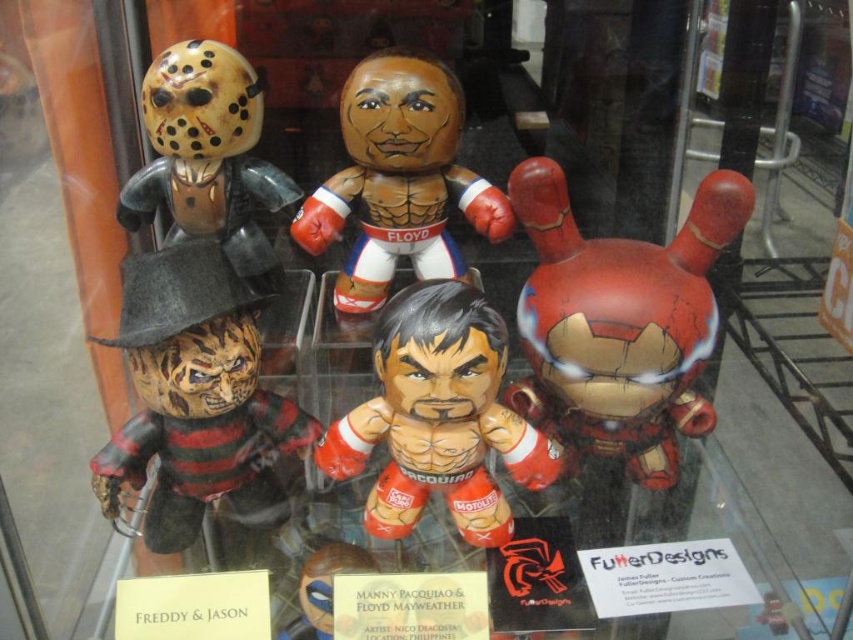
Is point (135, 273) behind point (456, 80)?

No.

Between wooden freddy krueger figure at left and matte brown figure at center, which one is positioned higher?

Positioned higher is matte brown figure at center.

You are a GUI agent. You are given a task and a screenshot of the screen. Output one action in this format:
    pyautogui.click(x=<x>, y=<y>)
    Task: Click on the wooden freddy krueger figure at left
    This screenshot has height=640, width=853.
    Given the screenshot: What is the action you would take?
    pyautogui.click(x=196, y=397)

Where is `wooden freddy krueger figure at left`? The height and width of the screenshot is (640, 853). wooden freddy krueger figure at left is located at coordinates (196, 397).

Can you confirm if cracked metallic iron man at right is positioned above matte red boxing glove at center?

Yes, cracked metallic iron man at right is above matte red boxing glove at center.

Image resolution: width=853 pixels, height=640 pixels. What do you see at coordinates (619, 323) in the screenshot? I see `cracked metallic iron man at right` at bounding box center [619, 323].

You are a GUI agent. You are given a task and a screenshot of the screen. Output one action in this format:
    pyautogui.click(x=<x>, y=<y>)
    Task: Click on the cracked metallic iron man at right
    The width and height of the screenshot is (853, 640).
    Given the screenshot: What is the action you would take?
    pyautogui.click(x=619, y=323)

Measure the distance from matte brown figure at center to matte black helmet at upper left.

matte brown figure at center is 7.76 inches away from matte black helmet at upper left.

Which is behind, point (387, 52) or point (235, 102)?

Point (387, 52)

Between point (436, 172) and point (242, 77), which one is positioned behind?

The point (436, 172) is more distant.

The height and width of the screenshot is (640, 853). I want to click on matte brown figure at center, so click(x=398, y=179).